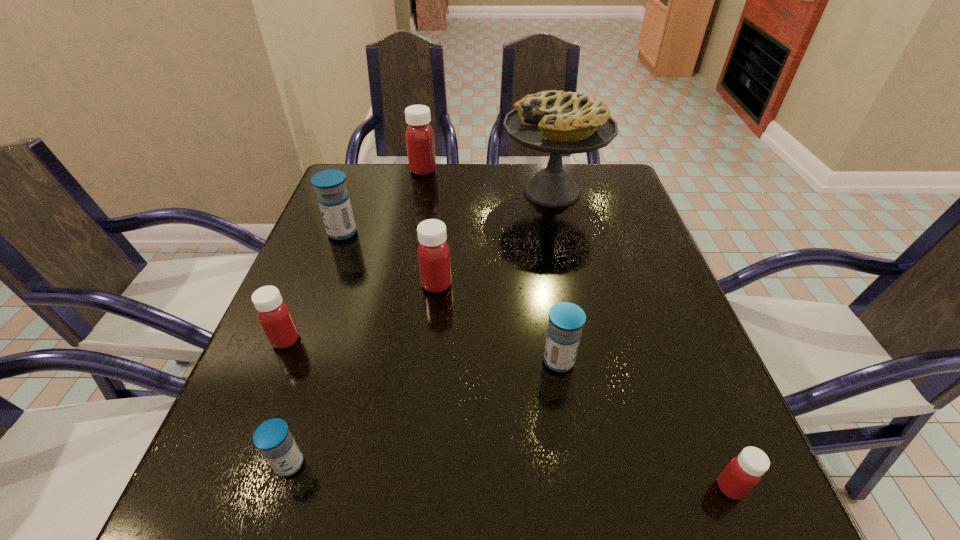
Find the location of a particular element. The width and height of the screenshot is (960, 540). free space between the pie and the second smallest blue medicine is located at coordinates (555, 276).

At what (x,y) coordinates should I click in order to perform the action: click on vacant space that is in between the tallest object and the rightmost medicine. Please return your answer as a coordinate pair (x, y). This screenshot has width=960, height=540. Looking at the image, I should click on (641, 340).

Locate an element on the screen. The image size is (960, 540). empty space between the seventh shortest object and the leftmost red medicine is located at coordinates (354, 255).

Where is `free space between the farthest blue medicine and the second nearest red medicine`? The width and height of the screenshot is (960, 540). free space between the farthest blue medicine and the second nearest red medicine is located at coordinates point(314,286).

At what (x,y) coordinates should I click in order to perform the action: click on free point between the third biggest red medicine and the tallest object. Please return your answer as a coordinate pair (x, y). The image size is (960, 540). Looking at the image, I should click on (419, 266).

Find the location of `object that is the third closest one to the pie`. object that is the third closest one to the pie is located at coordinates (333, 198).

Find the location of a particular element. the closest object to the smallest red medicine is located at coordinates (566, 320).

Locate an element on the screen. medicine that is the closest to the tallest object is located at coordinates (419, 135).

Point out which medicine is positioned as the fourth nearest to the smallest red medicine. Please provide its 2D coordinates. Your answer should be formatted as a tuple, i.e. [(x, y)], where the tuple contains the x and y coordinates of a point satisfying the conditions above.

[(274, 315)]

I want to click on the third closest red medicine relative to the rightmost medicine, so click(419, 135).